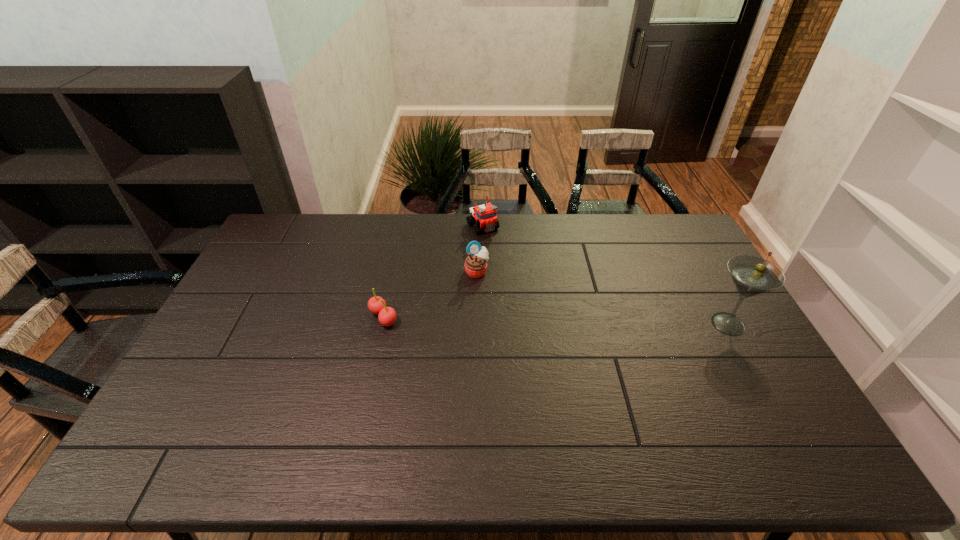
The height and width of the screenshot is (540, 960). I want to click on blank area located 0.270m on the front-facing side of the muffin, so (543, 322).

At what (x,y) coordinates should I click in order to perform the action: click on free space located on the front-facing side of the farthest object. Please return your answer as a coordinate pair (x, y). Looking at the image, I should click on (530, 285).

The width and height of the screenshot is (960, 540). I want to click on free region located 0.310m on the front-facing side of the farthest object, so click(x=531, y=287).

Identify the location of vacant space located on the front-facing side of the farthest object. (513, 264).

Find the location of `object located in the far edge section of the desktop`. object located in the far edge section of the desktop is located at coordinates (485, 215).

The image size is (960, 540). In order to click on object that is at the right edge in this screenshot , I will do `click(751, 275)`.

Locate an element on the screen. This screenshot has height=540, width=960. blank space at the far edge of the desktop is located at coordinates (407, 220).

The width and height of the screenshot is (960, 540). I want to click on free space at the near edge, so click(x=379, y=405).

In order to click on blank space at the left edge of the desktop in this screenshot , I will do `click(270, 276)`.

Image resolution: width=960 pixels, height=540 pixels. What are the coordinates of `free space at the right edge of the desktop` in the screenshot? It's located at (694, 274).